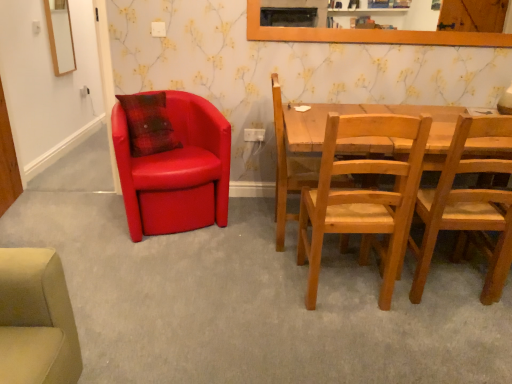
Find the location of `free space between matte leather chair at left, the 4th chair from the right, and wooden chair at center, positioned as the 3th chair in right-to-left order`. free space between matte leather chair at left, the 4th chair from the right, and wooden chair at center, positioned as the 3th chair in right-to-left order is located at coordinates (228, 226).